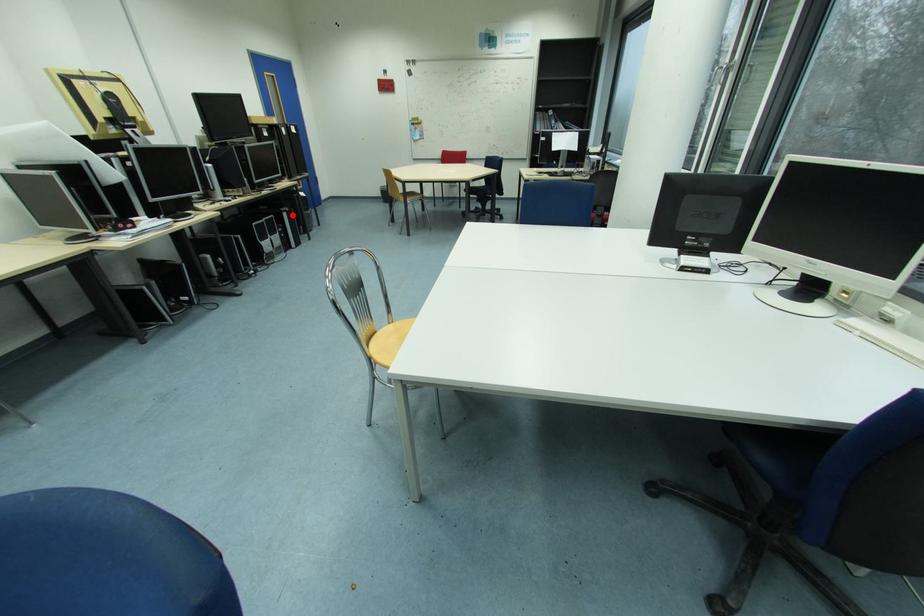
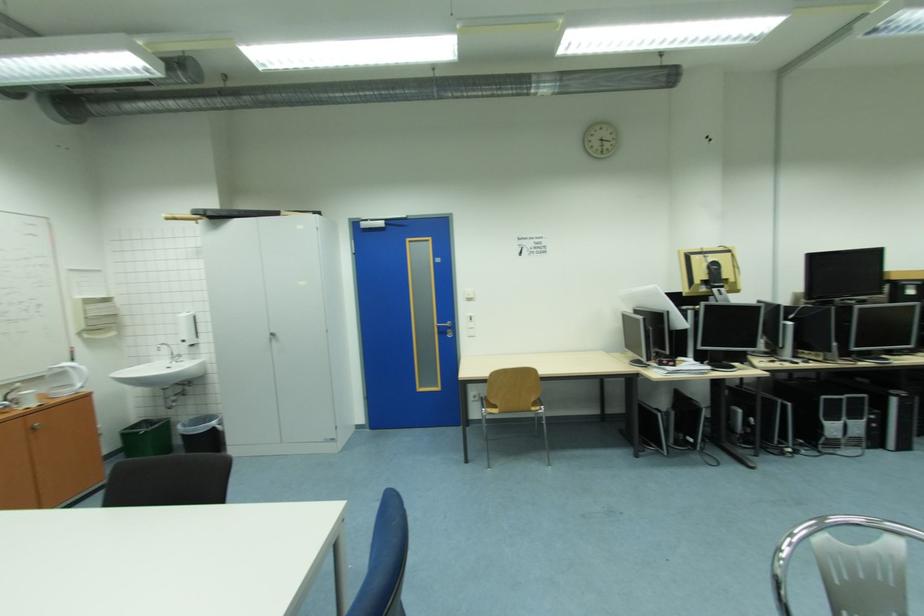
In the second image, find the point that corresponds to the highlighted location in the first image.

(901, 400)